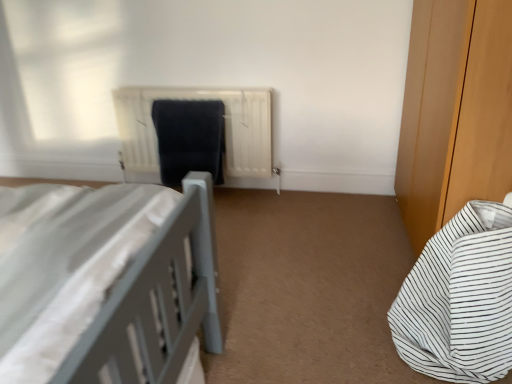
Question: Should I look upward or downward to see white striped fabric bed at lower right?

Choices:
 (A) up
 (B) down

Answer: (B)

Question: Is white striped fabric bed at lower right positioned in front of matte black laundry at center?

Choices:
 (A) no
 (B) yes

Answer: (B)

Question: Is white striped fabric bed at lower right not inside matte black laundry at center?

Choices:
 (A) yes
 (B) no

Answer: (A)

Question: Is white striped fabric bed at lower right wider than matte black laundry at center?

Choices:
 (A) no
 (B) yes

Answer: (B)

Question: Is matte black laundry at center inside white striped fabric bed at lower right?

Choices:
 (A) yes
 (B) no

Answer: (B)

Question: From a real-world perspective, is white striped fabric bed at lower right under matte black laundry at center?

Choices:
 (A) yes
 (B) no

Answer: (A)

Question: Does white striped fabric bed at lower right appear on the right side of matte black laundry at center?

Choices:
 (A) no
 (B) yes

Answer: (B)

Question: Could matte black laundry at center be considered to be inside white matte radiator at center?

Choices:
 (A) yes
 (B) no

Answer: (A)

Question: Can you confirm if white matte radiator at center is positioned to the right of matte black laundry at center?

Choices:
 (A) yes
 (B) no

Answer: (A)

Question: Is white matte radiator at center beside matte black laundry at center?

Choices:
 (A) yes
 (B) no

Answer: (B)

Question: Is white matte radiator at center bigger than matte black laundry at center?

Choices:
 (A) yes
 (B) no

Answer: (A)

Question: From the image's perspective, is white matte radiator at center beneath matte black laundry at center?

Choices:
 (A) no
 (B) yes

Answer: (A)

Question: From the image's perspective, is white matte radiator at center above matte black laundry at center?

Choices:
 (A) no
 (B) yes

Answer: (B)

Question: Is white striped fabric bed at lower right to the right of white matte radiator at center from the viewer's perspective?

Choices:
 (A) no
 (B) yes

Answer: (B)